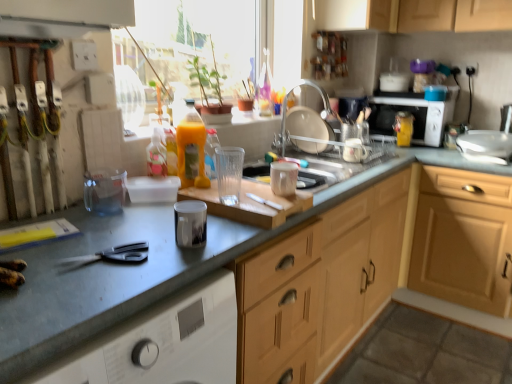
Locate an element on the screen. blank space to the left of black plastic scissors at lower left is located at coordinates [x=52, y=251].